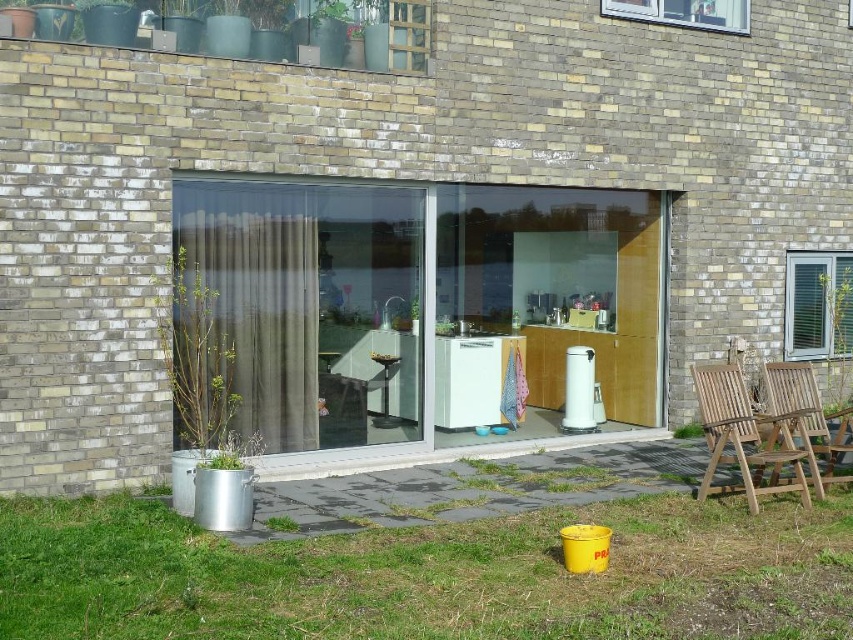
Question: Which of the following is the closest to the observer?

Choices:
 (A) (755, 422)
 (B) (383, 390)
 (C) (769, 435)

Answer: (A)

Question: Does transparent glass door at center have a larger size compared to teak wood chair at lower right?

Choices:
 (A) yes
 (B) no

Answer: (A)

Question: Which point is farther from the camera taking this photo?

Choices:
 (A) (791, 435)
 (B) (386, 387)

Answer: (B)

Question: Is transparent glass door at center thinner than teak wood chair at lower right?

Choices:
 (A) yes
 (B) no

Answer: (B)

Question: From the image, what is the correct spatial relationship of transparent glass door at center in relation to teak wood chairs at lower right?

Choices:
 (A) above
 (B) below

Answer: (A)

Question: Which point is farther to the camera?

Choices:
 (A) metallic silver stool at center
 (B) teak wood chair at lower right
 (C) teak wood chairs at lower right
 (D) transparent glass door at center

Answer: (A)